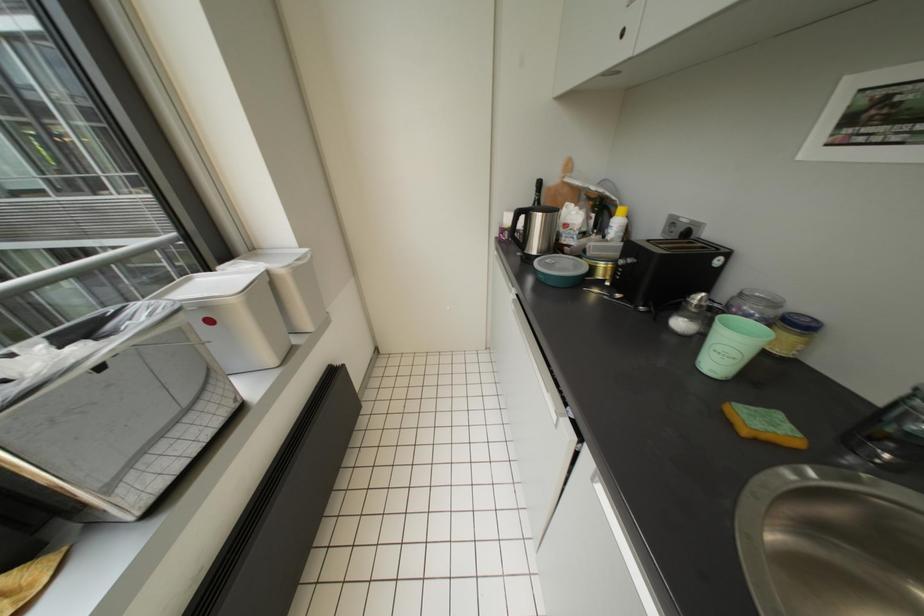
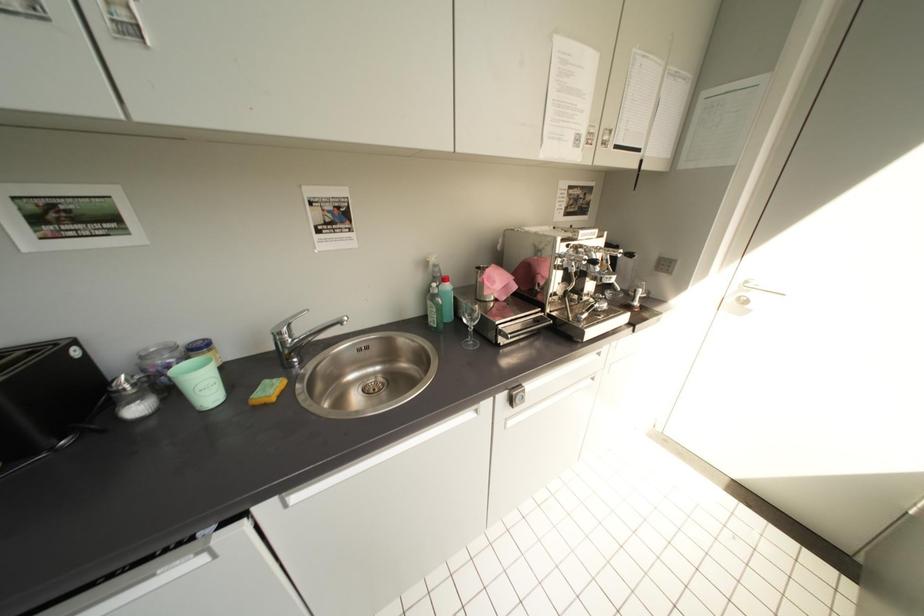
First-person continuous shooting, in which direction is the camera rotating?

The camera rotated toward right-down.